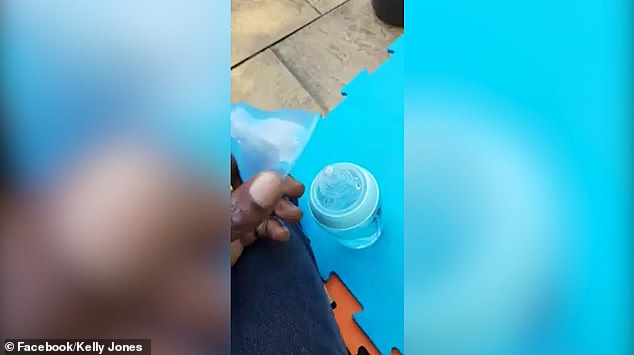
This screenshot has height=355, width=634. In order to click on plastic cover in this screenshot , I will do `click(271, 146)`.